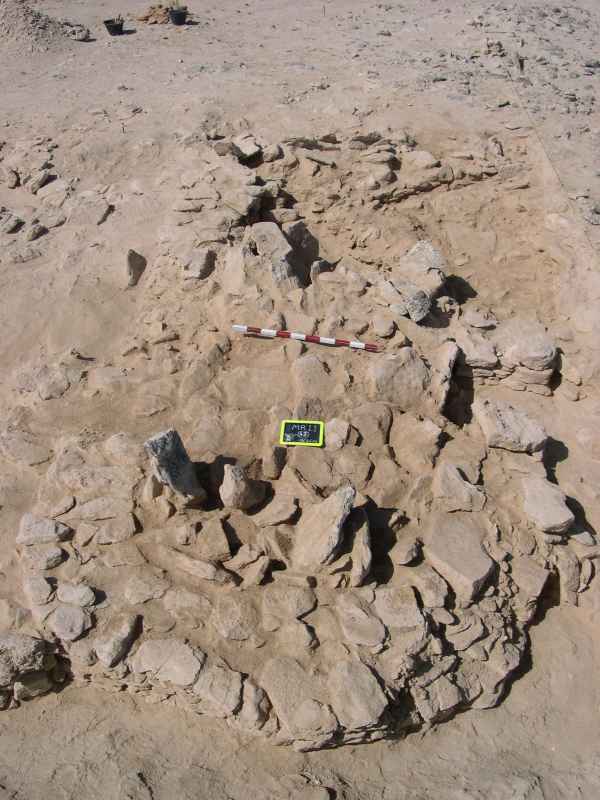
Where is `black chalkboard`? black chalkboard is located at coordinates (313, 434).